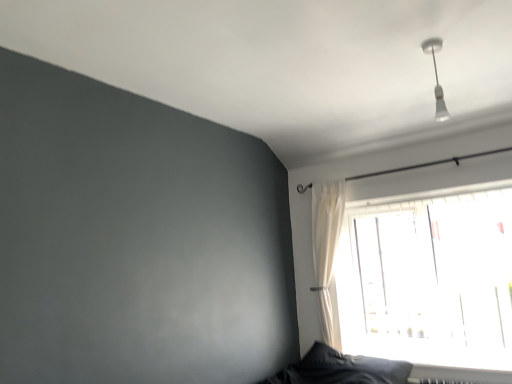
You are a GUI agent. You are given a task and a screenshot of the screen. Output one action in this format:
    pyautogui.click(x=<x>, y=<y>)
    Task: Click on the white glossy light fixture at upper right
    This screenshot has height=384, width=512.
    Given the screenshot: What is the action you would take?
    pyautogui.click(x=436, y=78)

What do you see at coordinates (347, 368) in the screenshot?
I see `dark gray fabric pillow at lower right` at bounding box center [347, 368].

Image resolution: width=512 pixels, height=384 pixels. I want to click on white sheer curtain at upper right, so click(x=326, y=246).

Is the depth of white glossy light fixture at upper right less than that of white sheer curtain at upper right?

Yes, the depth of white glossy light fixture at upper right is less than that of white sheer curtain at upper right.

From the image's perspective, is white glossy light fixture at upper right on white sheer curtain at upper right?

Indeed, from the image's perspective, white glossy light fixture at upper right is shown above white sheer curtain at upper right.

Is white glossy light fixture at upper right turned away from white sheer curtain at upper right?

No.

Which of these two, white glossy light fixture at upper right or white sheer curtain at upper right, is thinner?

With smaller width is white glossy light fixture at upper right.

What are the coordinates of `curtain located above the dark gray fabric pillow at lower right (from the image's perspective)` in the screenshot? It's located at (326, 246).

Is dark gray fabric pillow at lower right positioned with its back to white sheer curtain at upper right?

No, dark gray fabric pillow at lower right is not facing away from white sheer curtain at upper right.

Based on the photo, does dark gray fabric pillow at lower right contain white sheer curtain at upper right?

No, white sheer curtain at upper right is not inside dark gray fabric pillow at lower right.

Does dark gray fabric pillow at lower right have a greater width compared to white sheer curtain at upper right?

Indeed, dark gray fabric pillow at lower right has a greater width compared to white sheer curtain at upper right.

Considering the sizes of objects white glossy light fixture at upper right and dark gray fabric pillow at lower right in the image provided, who is smaller, white glossy light fixture at upper right or dark gray fabric pillow at lower right?

With smaller size is white glossy light fixture at upper right.

Which is correct: white glossy light fixture at upper right is inside dark gray fabric pillow at lower right, or outside of it?

white glossy light fixture at upper right is spatially situated outside dark gray fabric pillow at lower right.

Between white glossy light fixture at upper right and dark gray fabric pillow at lower right, which one is positioned in front?

white glossy light fixture at upper right is closer to the camera.

From the picture: From the image's perspective, who appears lower, white sheer curtain at upper right or transparent glass window at upper right?

transparent glass window at upper right appears lower in the image.

Is white sheer curtain at upper right bigger or smaller than transparent glass window at upper right?

In the image, white sheer curtain at upper right appears to be smaller than transparent glass window at upper right.

Is white sheer curtain at upper right taller than transparent glass window at upper right?

Yes.

Is white sheer curtain at upper right outside of transparent glass window at upper right?

white sheer curtain at upper right lies outside transparent glass window at upper right's area.

From the image's perspective, which object appears higher, transparent glass window at upper right or white glossy light fixture at upper right?

white glossy light fixture at upper right is shown above in the image.

Is transparent glass window at upper right not inside white glossy light fixture at upper right?

That's correct, transparent glass window at upper right is outside of white glossy light fixture at upper right.

Is transparent glass window at upper right bigger or smaller than white glossy light fixture at upper right?

Clearly, transparent glass window at upper right is larger in size than white glossy light fixture at upper right.

From the image's perspective, is white sheer curtain at upper right located above or below white glossy light fixture at upper right?

white sheer curtain at upper right is situated lower than white glossy light fixture at upper right in the image.

Who is taller, white sheer curtain at upper right or white glossy light fixture at upper right?

white sheer curtain at upper right is taller.

In terms of size, does white sheer curtain at upper right appear bigger or smaller than white glossy light fixture at upper right?

In the image, white sheer curtain at upper right appears to be larger than white glossy light fixture at upper right.

Measure the distance from transparent glass window at upper right to white sheer curtain at upper right.

transparent glass window at upper right is 19.90 inches away from white sheer curtain at upper right.

Considering the sizes of objects transparent glass window at upper right and white sheer curtain at upper right in the image provided, who is shorter, transparent glass window at upper right or white sheer curtain at upper right?

With less height is transparent glass window at upper right.

Does point (358, 205) appear closer or farther from the camera than point (340, 225)?

Point (358, 205) is positioned farther from the camera compared to point (340, 225).

Is transparent glass window at upper right oriented away from white sheer curtain at upper right?

transparent glass window at upper right does not have its back to white sheer curtain at upper right.

The image size is (512, 384). Find the location of `curtain behind the white glossy light fixture at upper right`. curtain behind the white glossy light fixture at upper right is located at coordinates (326, 246).

You are a GUI agent. You are given a task and a screenshot of the screen. Output one action in this format:
    pyautogui.click(x=<x>, y=<y>)
    Task: Click on the curtain above the dark gray fabric pillow at lower right (from a real-world perspective)
    The height and width of the screenshot is (384, 512).
    Given the screenshot: What is the action you would take?
    pyautogui.click(x=326, y=246)

From the image, which object appears to be nearer to white sheer curtain at upper right, dark gray fabric pillow at lower right or white glossy light fixture at upper right?

dark gray fabric pillow at lower right is positioned closer to the anchor white sheer curtain at upper right.

In the scene shown: When comparing their distances from transparent glass window at upper right, does white glossy light fixture at upper right or dark gray fabric pillow at lower right seem further?

white glossy light fixture at upper right lies further to transparent glass window at upper right than the other object.

Looking at the image, which one is located closer to white sheer curtain at upper right, transparent glass window at upper right or dark gray fabric pillow at lower right?

transparent glass window at upper right lies closer to white sheer curtain at upper right than the other object.

Based on their spatial positions, is transparent glass window at upper right or white glossy light fixture at upper right further from dark gray fabric pillow at lower right?

white glossy light fixture at upper right lies further to dark gray fabric pillow at lower right than the other object.

In the scene shown: When comparing their distances from white sheer curtain at upper right, does white glossy light fixture at upper right or transparent glass window at upper right seem closer?

transparent glass window at upper right is positioned closer to the anchor white sheer curtain at upper right.

Estimate the real-world distances between objects in this image. Which object is further from white sheer curtain at upper right, dark gray fabric pillow at lower right or transparent glass window at upper right?

dark gray fabric pillow at lower right lies further to white sheer curtain at upper right than the other object.

Based on their spatial positions, is transparent glass window at upper right or dark gray fabric pillow at lower right closer to white glossy light fixture at upper right?

transparent glass window at upper right is closer to white glossy light fixture at upper right.

Which object lies nearer to the anchor point white sheer curtain at upper right, transparent glass window at upper right or white glossy light fixture at upper right?

Based on the image, transparent glass window at upper right appears to be nearer to white sheer curtain at upper right.

At what (x,y) coordinates should I click in order to perform the action: click on pillow between white sheer curtain at upper right and transparent glass window at upper right. Please return your answer as a coordinate pair (x, y). This screenshot has height=384, width=512. Looking at the image, I should click on (347, 368).

The image size is (512, 384). I want to click on curtain between white glossy light fixture at upper right and dark gray fabric pillow at lower right in the up-down direction, so click(326, 246).

This screenshot has height=384, width=512. What are the coordinates of `curtain between white glossy light fixture at upper right and transparent glass window at upper right in the vertical direction` in the screenshot? It's located at (326, 246).

Where is `window between white glossy light fixture at upper right and dark gray fabric pillow at lower right from top to bottom`? This screenshot has height=384, width=512. window between white glossy light fixture at upper right and dark gray fabric pillow at lower right from top to bottom is located at coordinates (429, 277).